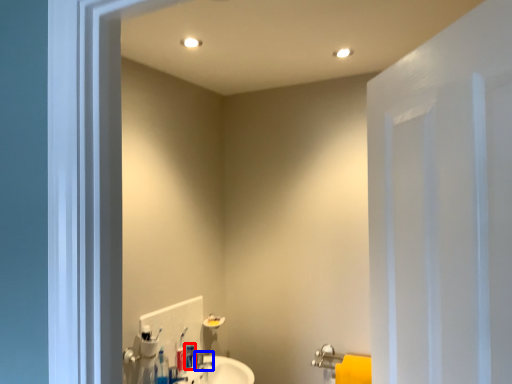
Question: Among these objects, which one is nearest to the camera, toiletry (highlighted by a red box) or plumbing fixture (highlighted by a blue box)?

Choices:
 (A) toiletry
 (B) plumbing fixture

Answer: (A)